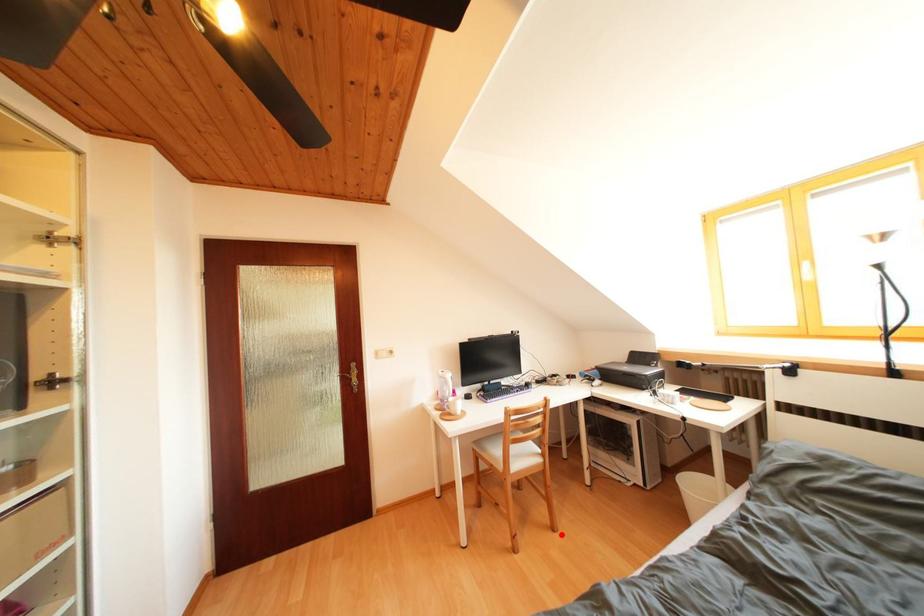
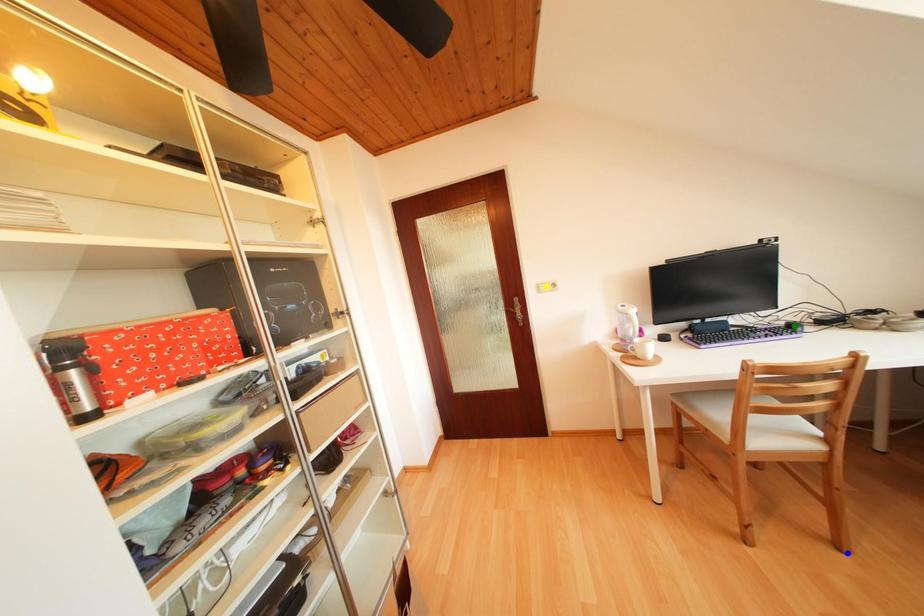
Question: I am providing you with two images of the same scene from different viewpoints. A red point is marked on the first image. You are given multiple points on the second image. Which point in image 2 represents the same 3d spot as the red point in image 1?

Choices:
 (A) yellow point
 (B) green point
 (C) blue point

Answer: (C)